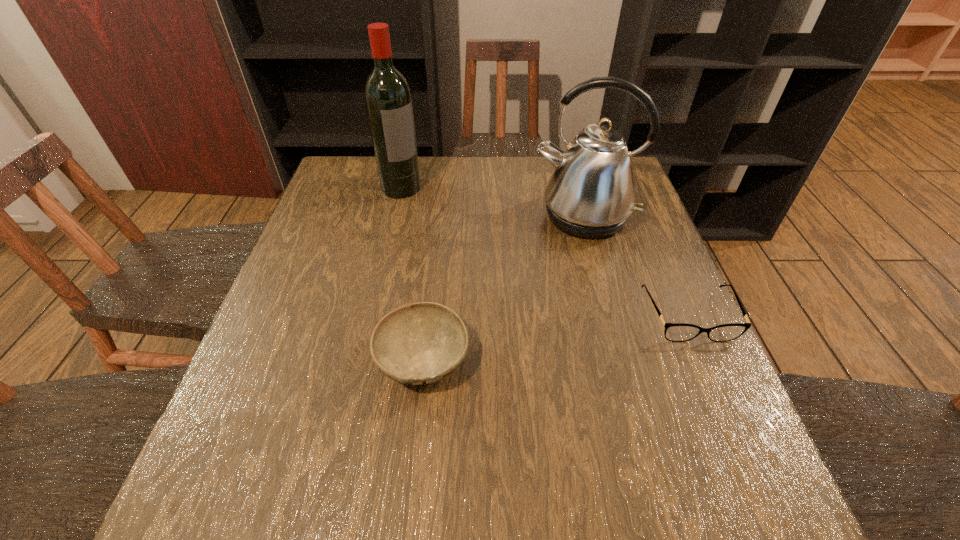
You are a GUI agent. You are given a task and a screenshot of the screen. Output one action in this format:
    pyautogui.click(x=<x>, y=<y>)
    Task: Click on the free space at the far edge of the desktop
    This screenshot has height=540, width=960.
    Given the screenshot: What is the action you would take?
    pyautogui.click(x=462, y=184)

In the image, there is a desktop. Where is `vacant space at the near edge`? The image size is (960, 540). vacant space at the near edge is located at coordinates (427, 422).

The height and width of the screenshot is (540, 960). In the image, there is a desktop. Find the location of `vacant area at the left edge`. vacant area at the left edge is located at coordinates (368, 214).

In the image, there is a desktop. Find the location of `free region at the right edge`. free region at the right edge is located at coordinates [x=677, y=295].

This screenshot has width=960, height=540. I want to click on free area in between the second tallest object and the third tallest object, so click(x=503, y=288).

This screenshot has height=540, width=960. I want to click on free space between the third tallest object and the wine bottle, so click(x=412, y=273).

Identify the location of vacant point located between the wine bottle and the second tallest object. Image resolution: width=960 pixels, height=540 pixels. (492, 202).

You are a GUI agent. You are given a task and a screenshot of the screen. Output one action in this format:
    pyautogui.click(x=<x>, y=<y>)
    Task: Click on the vacant region between the wine bottle and the second shortest object
    
    Given the screenshot: What is the action you would take?
    pyautogui.click(x=412, y=273)

Where is `free space between the spectacles and the second tallest object`? free space between the spectacles and the second tallest object is located at coordinates (636, 266).

Where is `free spot between the wine bottle and the second tallest object`? free spot between the wine bottle and the second tallest object is located at coordinates (492, 202).